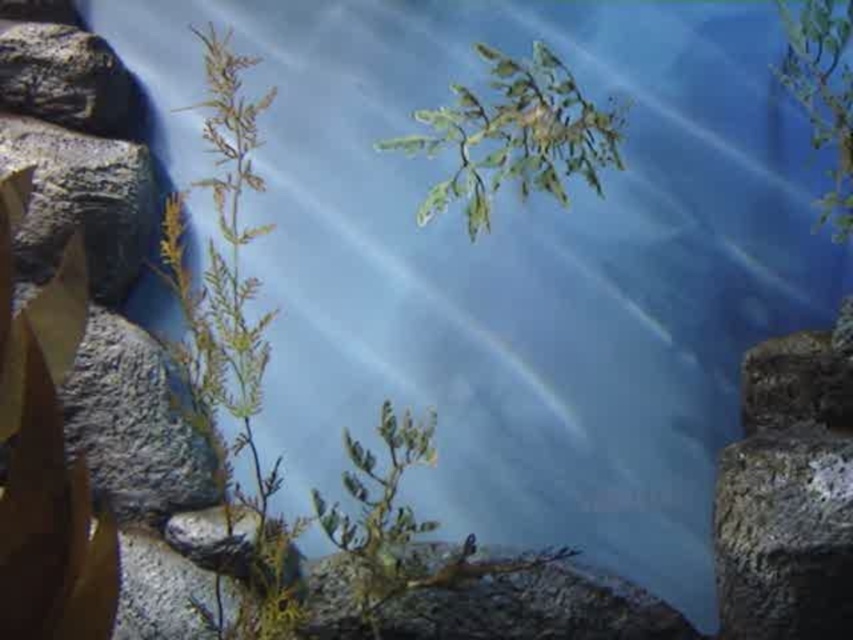
Which is below, rough gray rock at left or rough gray rock at upper left?

Positioned lower is rough gray rock at left.

Between rough gray rock at left and rough gray rock at upper left, which one has less height?

rough gray rock at upper left

Between point (107, 160) and point (88, 106), which one is positioned in front?

Point (107, 160)

At what (x,y) coordinates should I click in order to perform the action: click on rough gray rock at left. Please return your answer as a coordinate pair (x, y). The width and height of the screenshot is (853, 640). Looking at the image, I should click on (80, 202).

Is rough textured rock at right to the right of rough gray rock at left from the viewer's perspective?

Correct, you'll find rough textured rock at right to the right of rough gray rock at left.

Based on the photo, how distant is rough textured rock at right from rough gray rock at left?

A distance of 1.61 meters exists between rough textured rock at right and rough gray rock at left.

Image resolution: width=853 pixels, height=640 pixels. Identify the location of rough textured rock at right. (784, 536).

Is green leafy plant at left above green leafy plant at upper right?

Incorrect, green leafy plant at left is not positioned above green leafy plant at upper right.

The image size is (853, 640). I want to click on green leafy plant at left, so click(x=231, y=360).